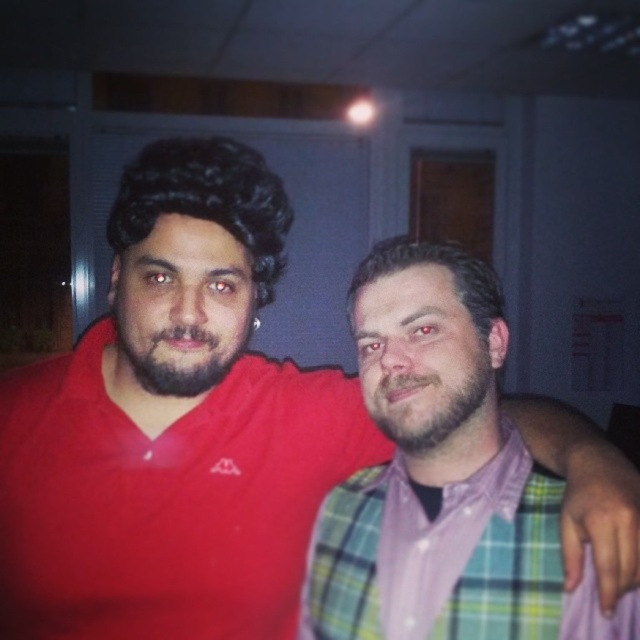
Question: Among these points, which one is nearest to the camera?

Choices:
 (A) 156,348
 (B) 365,525
 (C) 419,449

Answer: (A)

Question: Estimate the real-world distances between objects in this image. Which object is farther from the plaid fabric shirt at center?

Choices:
 (A) brownwoollybeard at center
 (B) dark brown fuzzy beard at center

Answer: (B)

Question: Where is dark brown fuzzy beard at center located in relation to brownwoollybeard at center in the image?

Choices:
 (A) above
 (B) below

Answer: (A)

Question: Which point is closer to the camera?

Choices:
 (A) dark brown fuzzy beard at center
 (B) brownwoollybeard at center
 (C) plaid fabric shirt at center

Answer: (C)

Question: Considering the relative positions of plaid fabric shirt at center and dark brown fuzzy beard at center in the image provided, where is plaid fabric shirt at center located with respect to dark brown fuzzy beard at center?

Choices:
 (A) right
 (B) left

Answer: (A)

Question: Is plaid fabric shirt at center to the left of dark brown fuzzy beard at center from the viewer's perspective?

Choices:
 (A) no
 (B) yes

Answer: (A)